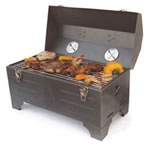
You are a GUI agent. You are given a task and a screenshot of the screen. Output one action in this format:
    pyautogui.click(x=<x>, y=<y>)
    Task: Click on the back right table leg
    This screenshot has width=150, height=147.
    Given the screenshot: What is the action you would take?
    pyautogui.click(x=125, y=110)